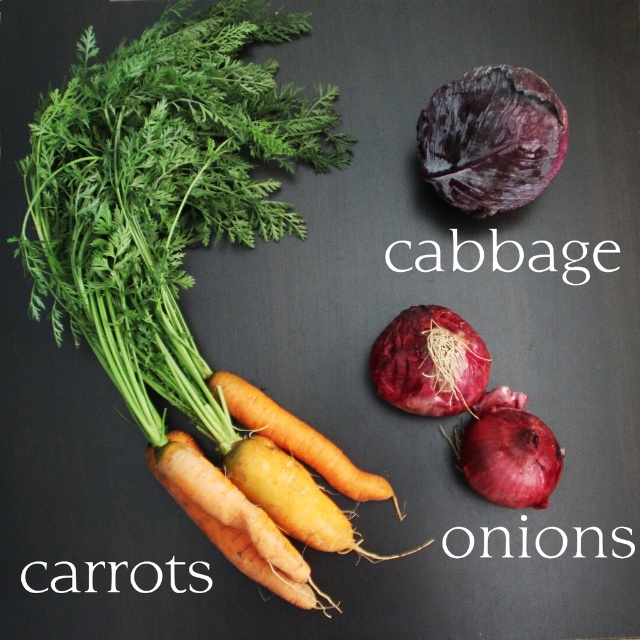
Question: Can you confirm if purple/red textured cabbage at upper right is smaller than orange matte carrots at center?

Choices:
 (A) no
 (B) yes

Answer: (A)

Question: Which of these objects is positioned closest to the purple matte onion at center?

Choices:
 (A) orange smooth carrots at lower left
 (B) orange matte carrots at center
 (C) shiny purple onion at center right
 (D) purple/red textured cabbage at upper right

Answer: (C)

Question: Among these objects, which one is farthest from the camera?

Choices:
 (A) purple matte onion at center
 (B) orange smooth carrots at lower left
 (C) purple/red textured cabbage at upper right

Answer: (A)

Question: Considering the relative positions of shiny purple onion at center right and orange matte carrots at center in the image provided, where is shiny purple onion at center right located with respect to orange matte carrots at center?

Choices:
 (A) left
 (B) right

Answer: (B)

Question: Is shiny purple onion at center right further to camera compared to orange matte carrots at center?

Choices:
 (A) no
 (B) yes

Answer: (A)

Question: Which object is closer to the camera taking this photo?

Choices:
 (A) orange smooth carrots at lower left
 (B) orange matte carrots at center
 (C) purple/red textured cabbage at upper right
 (D) purple matte onion at center

Answer: (A)